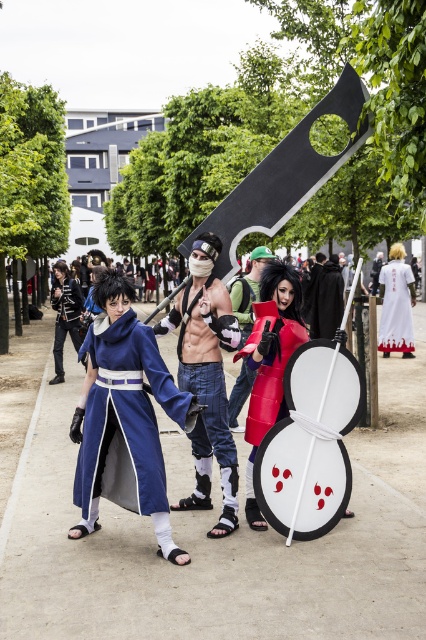
Measure the distance between matte blue fabric coat at left and white matte dress at right.

They are 9.43 meters apart.

Is point (126, 401) behind point (386, 339)?

No, (126, 401) is in front of (386, 339).

Which is in front, point (103, 328) or point (377, 340)?

Point (103, 328) is more forward.

I want to click on matte blue fabric coat at left, so click(x=124, y=419).

Can you confirm if denim jeans at center is bigger than white matte dress at right?

Indeed, denim jeans at center has a larger size compared to white matte dress at right.

Locate an element on the screen. denim jeans at center is located at coordinates click(207, 378).

Is matte red shield at center positioned in front of matte black armor at left?

Yes, it is in front of matte black armor at left.

Can you confirm if matte red shield at center is positioned above matte black armor at left?

No.

Which is behind, point (247, 413) or point (60, 260)?

Point (60, 260)

Identify the location of matte red shield at center. (270, 364).